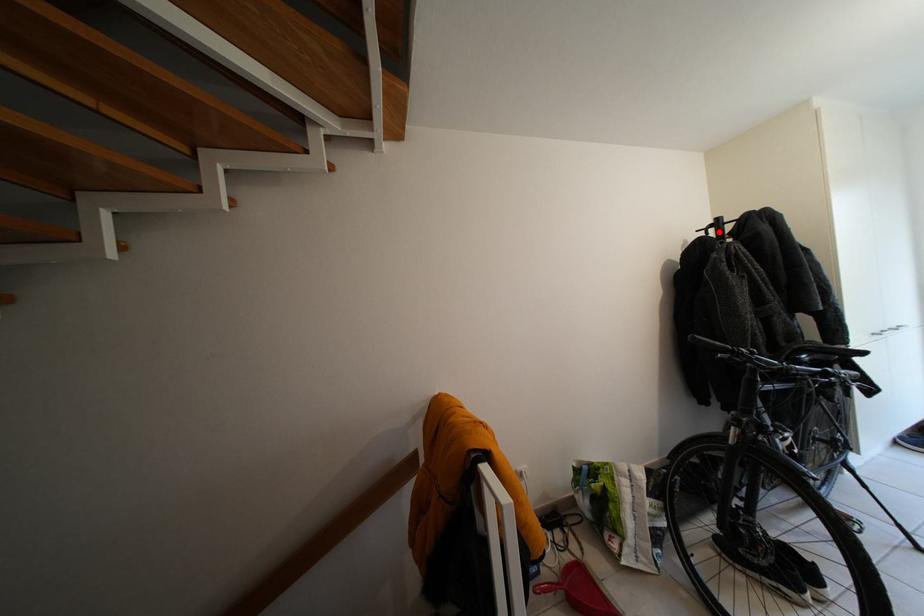
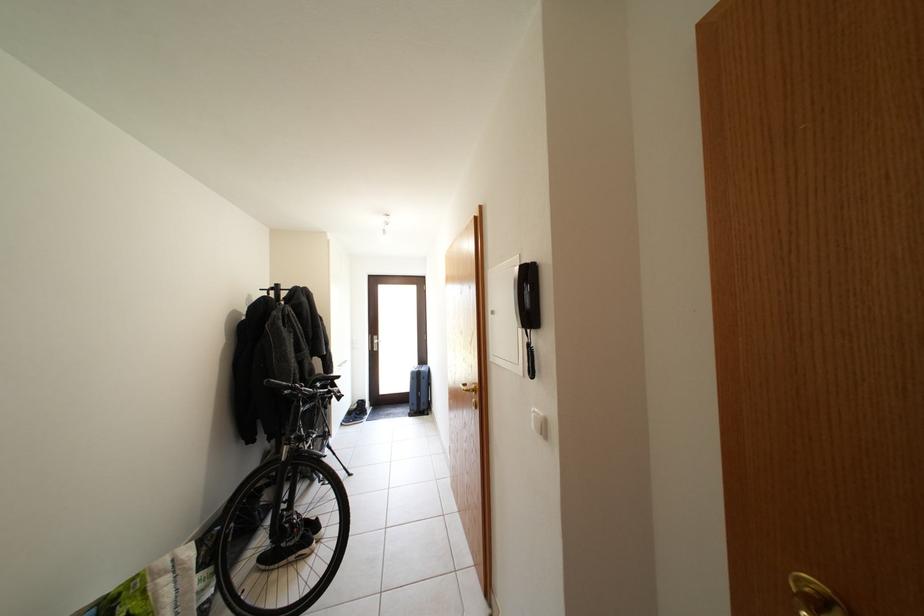
In the second image, find the point that corresponds to the highlighted location in the first image.

(281, 294)